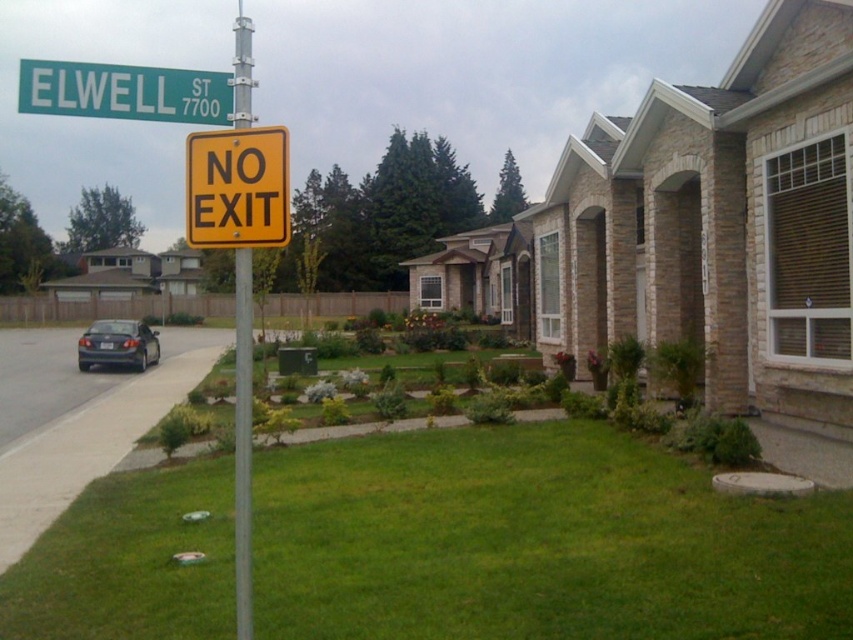
Question: Among these points, which one is nearest to the camera?

Choices:
 (A) (207, 112)
 (B) (102, 342)
 (C) (241, 228)
 (D) (244, 320)

Answer: (D)

Question: Which point is farther to the camera?

Choices:
 (A) 241,502
 (B) 195,77
 (C) 113,356

Answer: (C)

Question: Which of the following is the closest to the observer?

Choices:
 (A) shiny dark gray sedan at left
 (B) metallic pole at center
 (C) green plastic street sign at upper left
 (D) yellow matte/no exit sign at upper center

Answer: (D)

Question: Is yellow matte/no exit sign at upper center positioned at the back of shiny dark gray sedan at left?

Choices:
 (A) no
 (B) yes

Answer: (A)

Question: Can you confirm if yellow matte/no exit sign at upper center is positioned to the left of green plastic street sign at upper left?

Choices:
 (A) no
 (B) yes

Answer: (A)

Question: Is green plastic street sign at upper left thinner than shiny dark gray sedan at left?

Choices:
 (A) yes
 (B) no

Answer: (B)